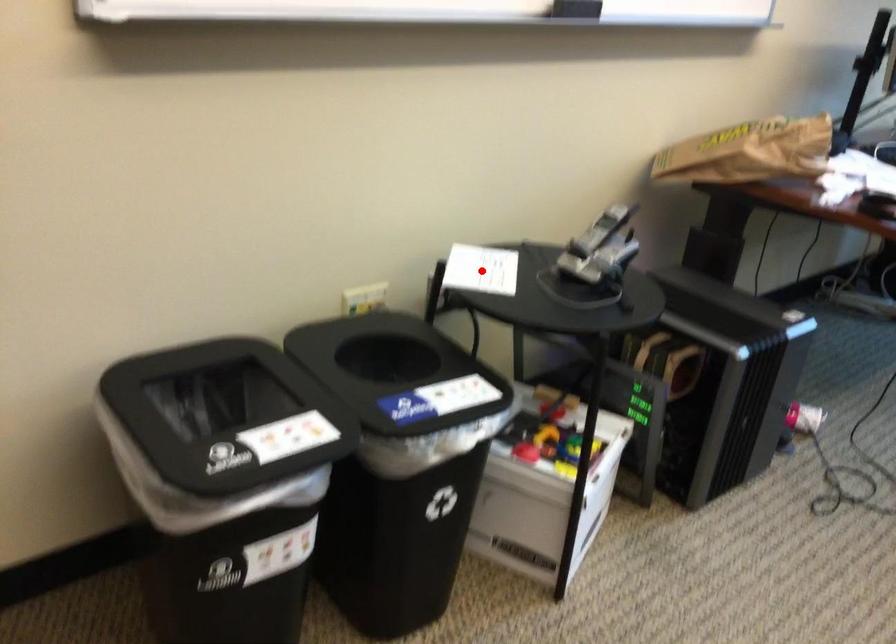
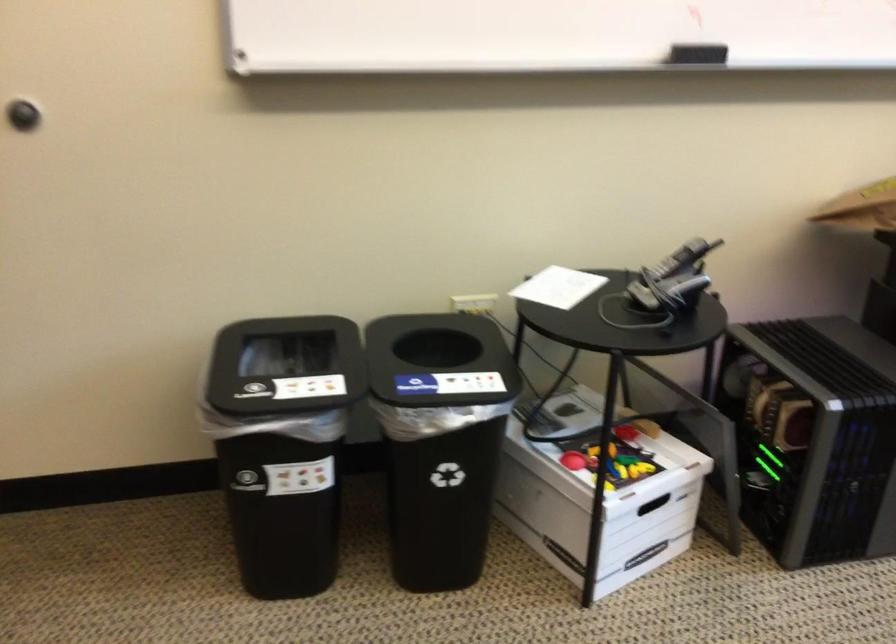
Where in the second image is the point corresponding to the highlighted location from the first image?

(558, 287)